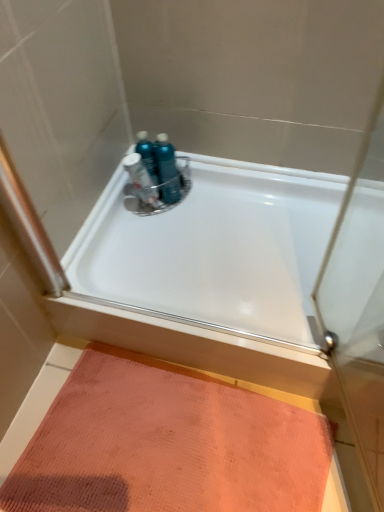
At what (x,y) coordinates should I click in order to perform the action: click on vacant space to the right of translucent plastic bottles at center, positioned as the third toiletry in right-to-left order. Please return your answer as a coordinate pair (x, y). Looking at the image, I should click on (x=200, y=205).